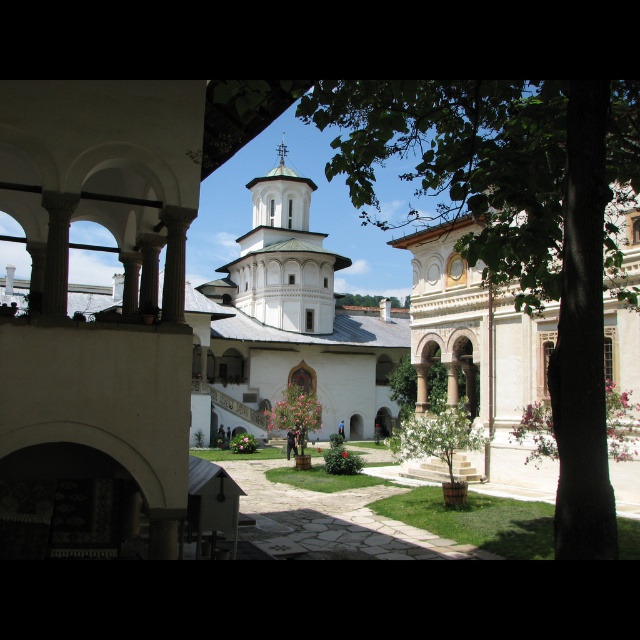
You are standing at the entrance of the courtyard and want to locate the green leafy tree at center. According to the coordinates provided, in which direction should you walk to reach it?

The green leafy tree at center is located at coordinates point (516,225). Since you are at the entrance, you should walk towards the center of the courtyard to reach it.

You are a visitor standing at the entrance of the courtyard. You want to take a photo of both the green leafy tree at center and the white smooth tower at center in the same frame. Based on their distance, can you estimate if they will both fit in your camera viewfinder?

The green leafy tree at center is 37.09 meters away from the white smooth tower at center. Since they are relatively far apart, it might be challenging to capture both in the same frame without zooming out significantly. However, using a wide angle lens could help include both in the photo.